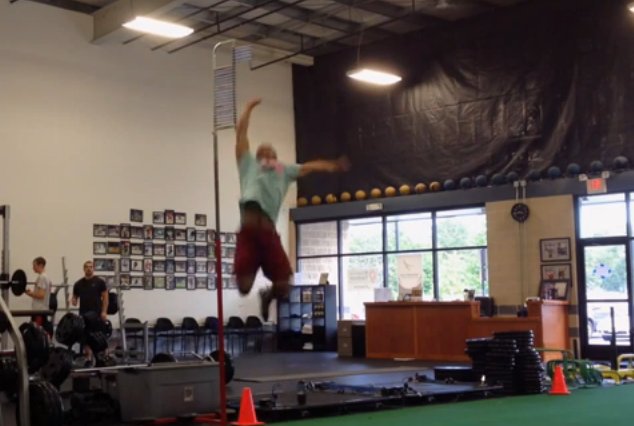
Identify the location of yellowish tannish walls. (136, 160).